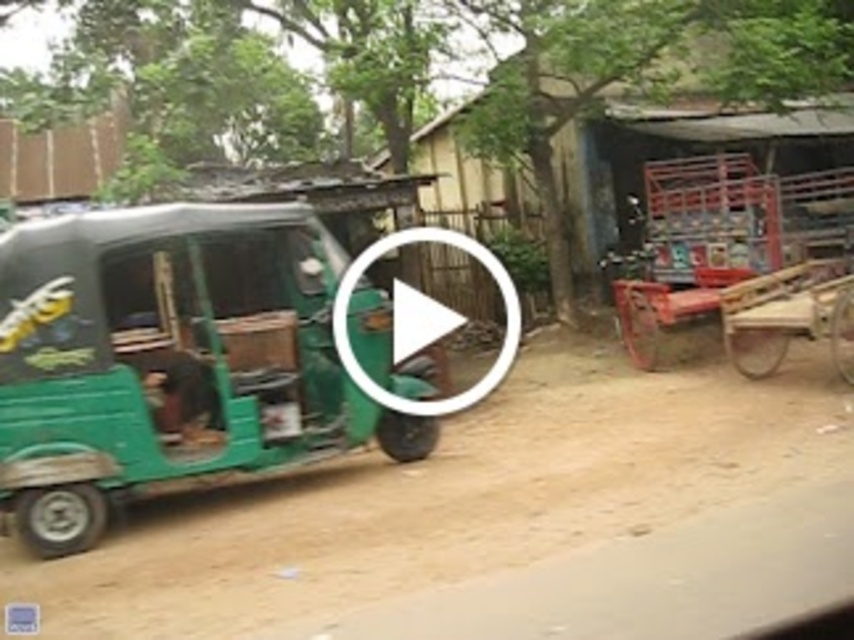
Question: Is the position of green matte auto-rickshaw at left less distant than that of rustic wooden hut at center?

Choices:
 (A) no
 (B) yes

Answer: (B)

Question: Which point is farther to the camera?

Choices:
 (A) brown dirt track at center
 (B) rusty metal cart at right
 (C) green matte auto-rickshaw at left
 (D) rustic wooden hut at center

Answer: (D)

Question: Which point is closer to the camera?

Choices:
 (A) rusty metal cart at right
 (B) green matte auto-rickshaw at left

Answer: (B)

Question: Observing the image, what is the correct spatial positioning of brown dirt track at center in reference to rusty metal cart at right?

Choices:
 (A) below
 (B) above

Answer: (A)

Question: Estimate the real-world distances between objects in this image. Which object is farther from the rustic wooden hut at center?

Choices:
 (A) green matte auto-rickshaw at left
 (B) brown dirt track at center
 (C) rusty metal cart at right

Answer: (A)

Question: Does rustic wooden hut at center appear over rusty metal cart at right?

Choices:
 (A) yes
 (B) no

Answer: (A)